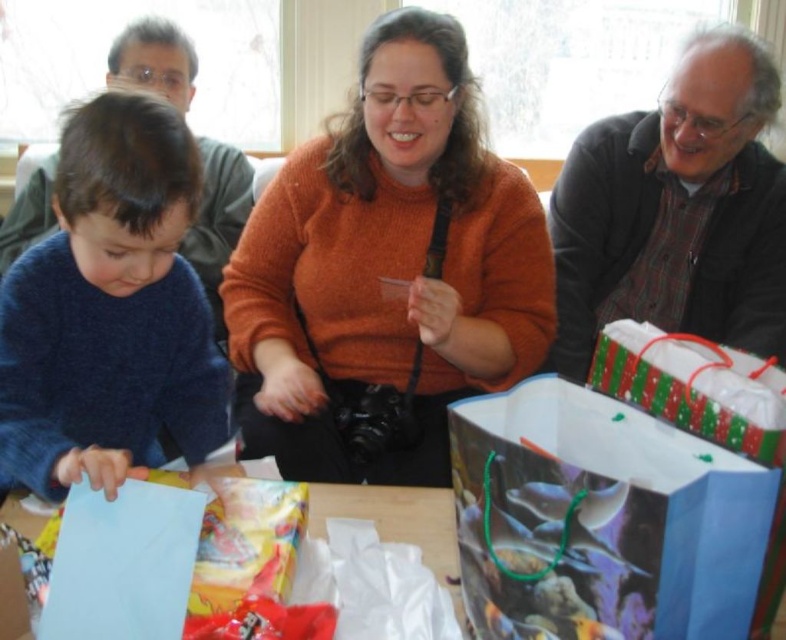
What do you see at coordinates (676, 211) in the screenshot? This screenshot has width=786, height=640. I see `plaid flannel shirt at right` at bounding box center [676, 211].

In the scene shown: Does plaid flannel shirt at right have a smaller size compared to matte gray sweater at left?

No, plaid flannel shirt at right is not smaller than matte gray sweater at left.

Between point (685, 150) and point (215, 243), which one is positioned in front?

Point (685, 150) is more forward.

Locate an element on the screen. The width and height of the screenshot is (786, 640). plaid flannel shirt at right is located at coordinates (676, 211).

Which is below, green and white paper gift bag at right or matte gray sweater at left?

Positioned lower is green and white paper gift bag at right.

Looking at this image, between green and white paper gift bag at right and matte gray sweater at left, which one has more height?

Standing taller between the two is matte gray sweater at left.

Is point (775, 412) farther from viewer compared to point (10, 237)?

No, (775, 412) is in front of (10, 237).

At what (x,y) coordinates should I click in order to perform the action: click on green and white paper gift bag at right. Please return your answer as a coordinate pair (x, y). Looking at the image, I should click on (695, 387).

Between point (175, 289) and point (461, 618), which one is positioned in front?

Point (461, 618)

Which is more to the left, dark blue sweater at left or blue paper at lower left?

From the viewer's perspective, dark blue sweater at left appears more on the left side.

Does point (79, 348) lie behind point (322, 534)?

Yes.

At what (x,y) coordinates should I click in order to perform the action: click on dark blue sweater at left. Please return your answer as a coordinate pair (x, y). This screenshot has width=786, height=640. Looking at the image, I should click on (109, 305).